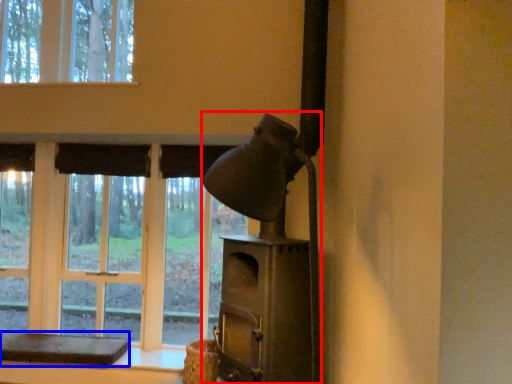
Question: Which object appears closest to the camera in this image, fireplace (highlighted by a red box) or furniture (highlighted by a blue box)?

Choices:
 (A) fireplace
 (B) furniture

Answer: (A)